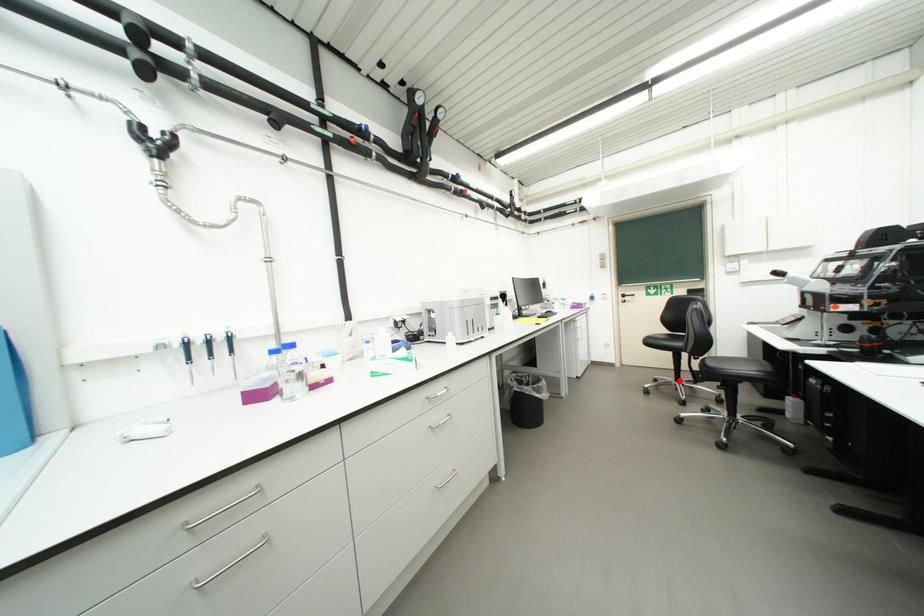
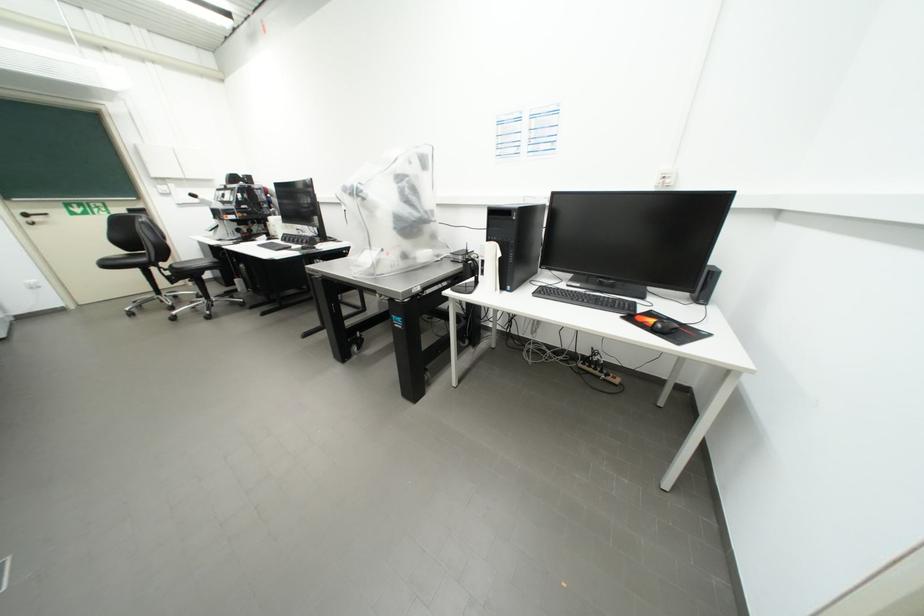
Question: I am providing you with two images of the same scene from different viewpoints. A red point is marked on the first image. At the location where the point appears in image 1, is it still visible in image 2?

Choices:
 (A) Yes
 (B) No

Answer: (A)